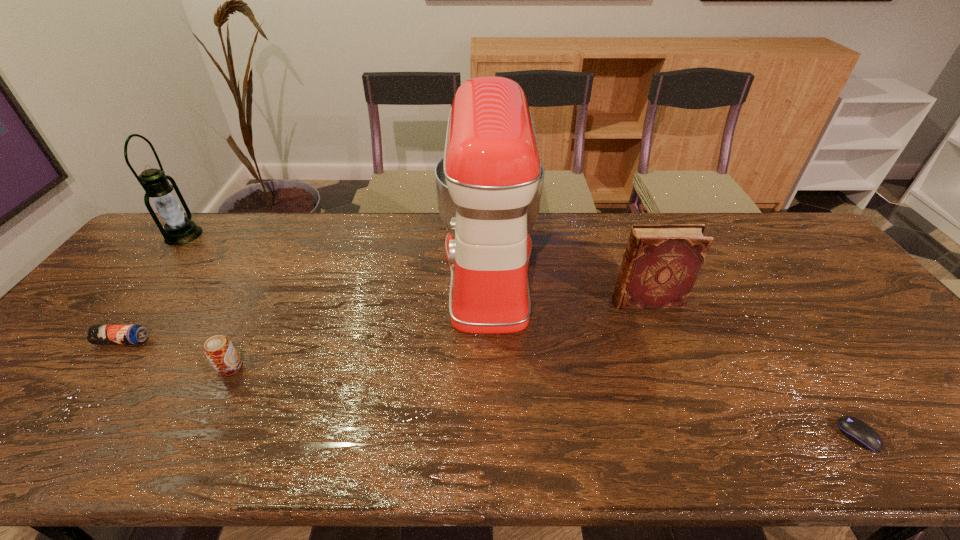
At what (x,y) coordinates should I click in order to perform the action: click on vacant space situated on the back of the shortest object. Please return your answer as a coordinate pair (x, y). Looking at the image, I should click on (782, 323).

I want to click on mixer at the far edge, so click(x=489, y=184).

Locate an element on the screen. lantern located at the far edge is located at coordinates (179, 230).

At what (x,y) coordinates should I click in order to perform the action: click on object that is at the near edge. Please return your answer as a coordinate pair (x, y). Looking at the image, I should click on (856, 430).

This screenshot has height=540, width=960. I want to click on lantern positioned at the left edge, so click(x=179, y=230).

Find the location of a particular element. The image size is (960, 540). beer can that is at the left edge is located at coordinates (97, 334).

Find the location of `object that is at the far left corner`. object that is at the far left corner is located at coordinates (179, 230).

Identify the location of vacant space at the far edge. The height and width of the screenshot is (540, 960). (237, 224).

The image size is (960, 540). I want to click on vacant position at the near edge of the desktop, so pyautogui.click(x=163, y=429).

Locate an element on the screen. blank space at the left edge of the desktop is located at coordinates (58, 360).